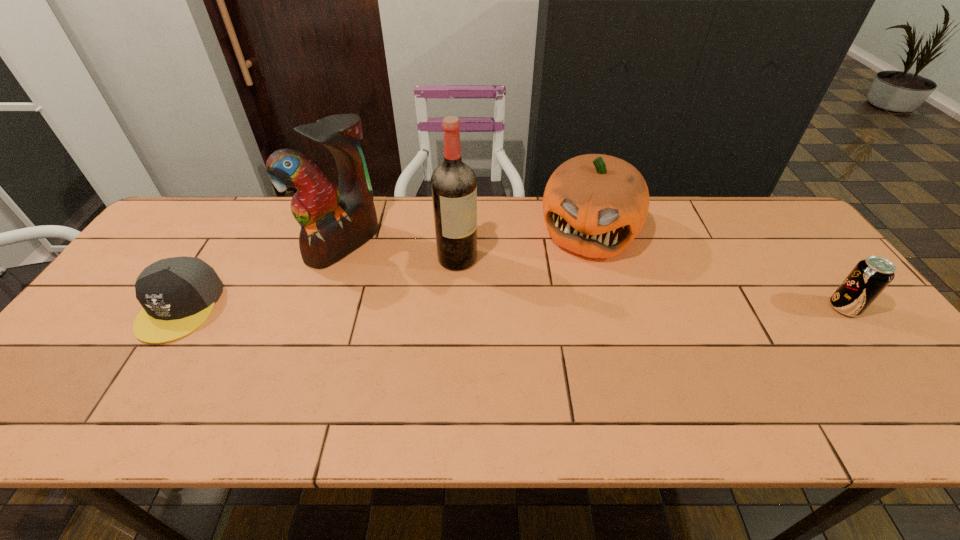
The image size is (960, 540). Find the location of `pumpkin located at the far edge`. pumpkin located at the far edge is located at coordinates (594, 205).

I want to click on parrot present at the far edge, so click(334, 221).

Identify the location of object that is at the left edge. This screenshot has height=540, width=960. (178, 294).

At what (x,y) coordinates should I click in order to perform the action: click on object located in the right edge section of the desktop. Please return your answer as a coordinate pair (x, y). The height and width of the screenshot is (540, 960). Looking at the image, I should click on (867, 280).

Image resolution: width=960 pixels, height=540 pixels. I want to click on free space at the far edge of the desktop, so click(x=708, y=208).

Where is `free space at the near edge of the desktop`? The width and height of the screenshot is (960, 540). free space at the near edge of the desktop is located at coordinates (615, 361).

In the image, there is a desktop. Where is `vacant space at the right edge`? This screenshot has height=540, width=960. vacant space at the right edge is located at coordinates (821, 282).

Where is `vacant space in between the shortest object and the parrot`? vacant space in between the shortest object and the parrot is located at coordinates (262, 275).

Locate an element on the screen. The width and height of the screenshot is (960, 540). vacant space that's between the leftmost object and the fourth object from right to left is located at coordinates (262, 275).

This screenshot has height=540, width=960. What are the coordinates of `vacant space that's between the shortest object and the second object from left to right` in the screenshot? It's located at (262, 275).